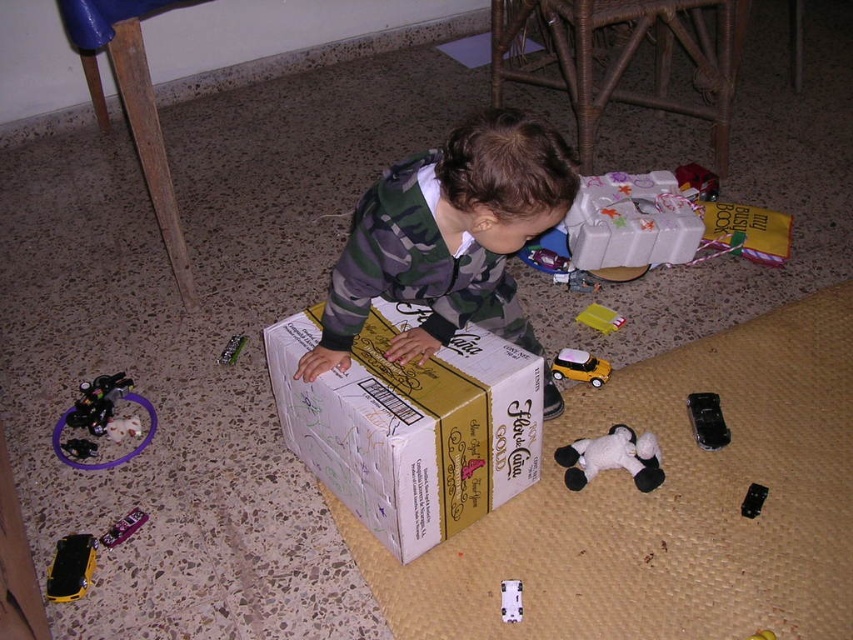
Question: Is metallic black toy car at left bigger than plush pink teddy bear at center?

Choices:
 (A) no
 (B) yes

Answer: (B)

Question: Does yellow plastic toy at center appear under metallic silver remote control at center?

Choices:
 (A) yes
 (B) no

Answer: (B)

Question: Which is farther from the yellow plastic toy at center?

Choices:
 (A) metallic black toy car at left
 (B) metallic purple toy car at lower left
 (C) camouflage fabric toddler at center

Answer: (B)

Question: Which point appears farthest from the camera in this image?

Choices:
 (A) (589, 444)
 (B) (514, 605)
 (C) (224, 360)
 (D) (97, 540)

Answer: (C)

Question: Which point is closer to the camera?

Choices:
 (A) (511, 589)
 (B) (583, 316)
 (C) (693, 420)

Answer: (A)

Question: Considering the relative positions of white cardboard box at center and metallic silver remote control at center in the image provided, where is white cardboard box at center located with respect to metallic silver remote control at center?

Choices:
 (A) left
 (B) right

Answer: (B)